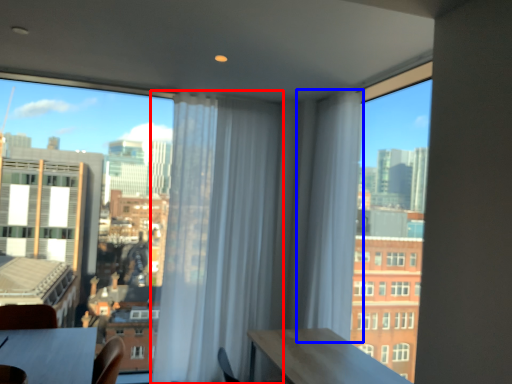
Question: Among these objects, which one is farthest to the camera, curtain (highlighted by a red box) or curtain (highlighted by a blue box)?

Choices:
 (A) curtain
 (B) curtain

Answer: (A)